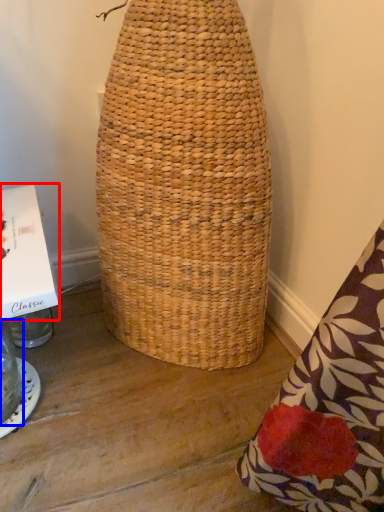
Question: Which object is further to the camera taking this photo, cardboard box (highlighted by a red box) or glass jar (highlighted by a blue box)?

Choices:
 (A) cardboard box
 (B) glass jar

Answer: (B)